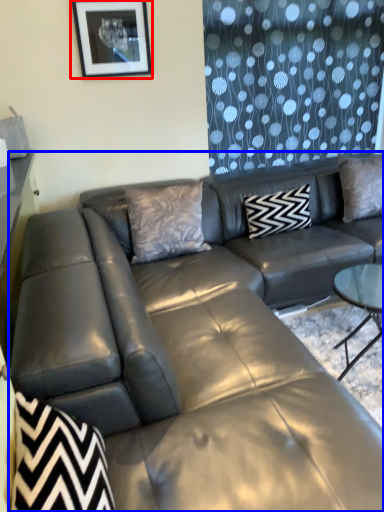
Question: Which of the following is the farthest to the observer, picture frame (highlighted by a red box) or studio couch (highlighted by a blue box)?

Choices:
 (A) picture frame
 (B) studio couch

Answer: (A)